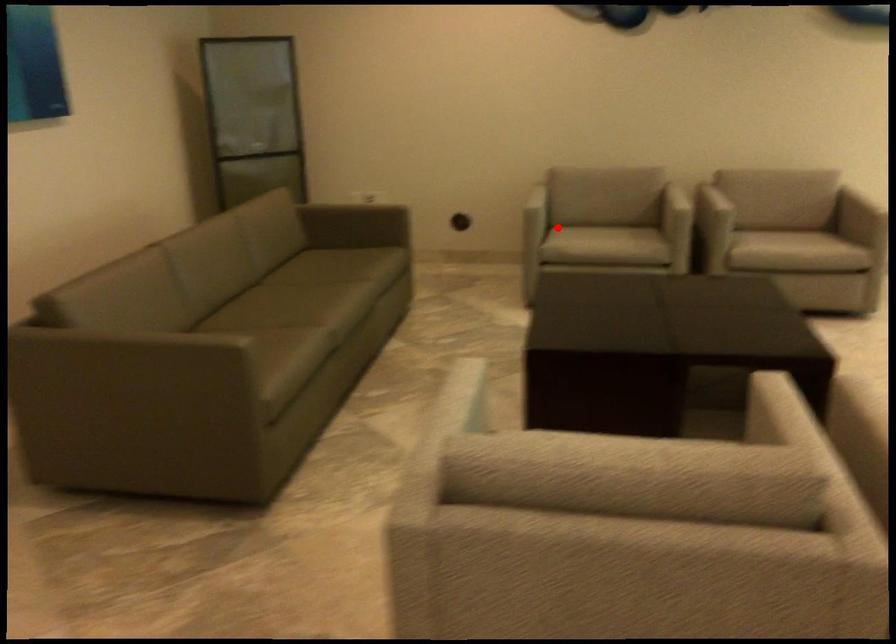
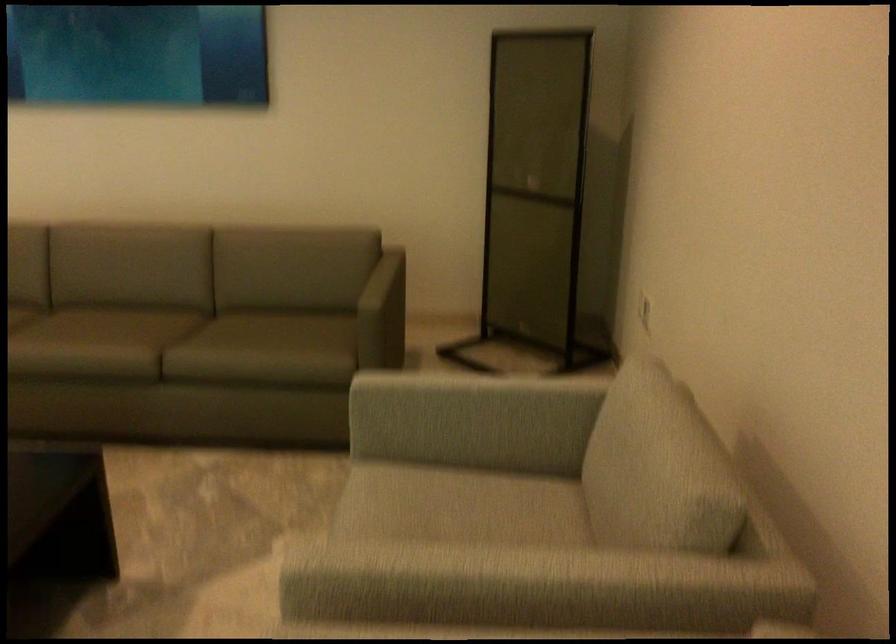
The point at the highlighted location is marked in the first image. Where is the corresponding point in the second image?

(455, 491)